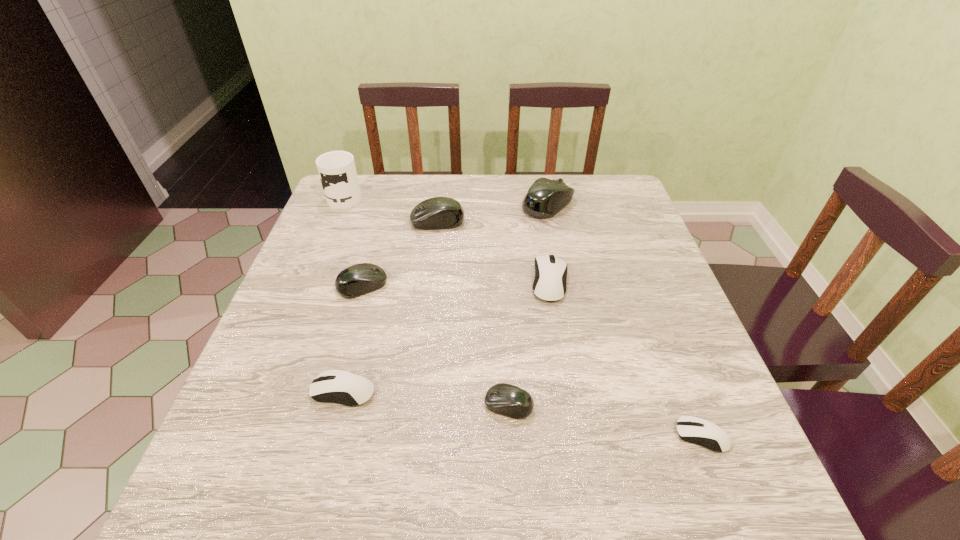
The width and height of the screenshot is (960, 540). In order to click on free space between the third farthest black mouse and the second white mouse from left to right in this screenshot , I will do `click(456, 284)`.

Locate an element on the screen. The image size is (960, 540). object that is the second nearest to the farthest white mouse is located at coordinates (439, 212).

Where is `object that is the third closest one to the nearest white mouse`? object that is the third closest one to the nearest white mouse is located at coordinates (355, 389).

This screenshot has width=960, height=540. In order to click on mouse that stands as the fourth closest to the second black mouse from left to right in this screenshot , I will do `click(355, 389)`.

Choose which mouse is the seventh nearest neighbor to the mug. Please provide its 2D coordinates. Your answer should be formatted as a tuple, i.e. [(x, y)], where the tuple contains the x and y coordinates of a point satisfying the conditions above.

[(692, 429)]

At what (x,y) coordinates should I click in order to perform the action: click on black mouse that can be found as the closest to the farthest white mouse. Please return your answer as a coordinate pair (x, y). This screenshot has height=540, width=960. Looking at the image, I should click on (545, 198).

Where is `black mouse that is the closest to the fourth mouse from left to right`? This screenshot has height=540, width=960. black mouse that is the closest to the fourth mouse from left to right is located at coordinates (359, 279).

Identify which white mouse is located as the nearest to the leftmost white mouse. Please provide its 2D coordinates. Your answer should be formatted as a tuple, i.e. [(x, y)], where the tuple contains the x and y coordinates of a point satisfying the conditions above.

[(550, 283)]

I want to click on white mouse that is the second closest one to the shortest object, so click(355, 389).

Locate an element on the screen. This screenshot has height=540, width=960. blank space that satisfies the following two spatial constraints: 1. on the front side of the leftmost black mouse; 2. on the right side of the fourth mouse from right to left is located at coordinates (329, 405).